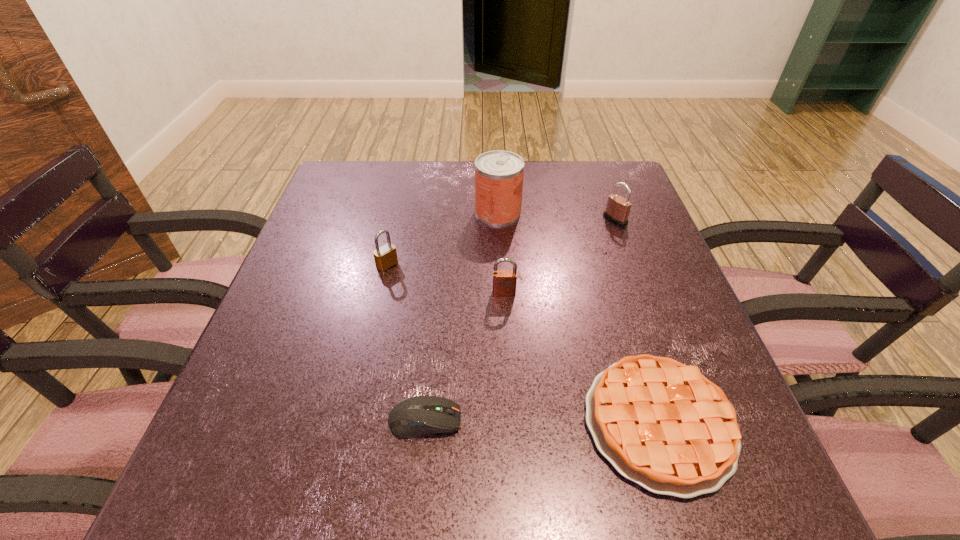
This screenshot has width=960, height=540. What are the coordinates of `free space located 0.080m on the back of the second farthest padlock` in the screenshot? It's located at (394, 236).

Where is `free space located 0.190m on the front-facing side of the third nearest object`? free space located 0.190m on the front-facing side of the third nearest object is located at coordinates (509, 374).

Identify the location of free space located on the left of the pie. (355, 423).

This screenshot has height=540, width=960. Identify the location of vacant area situated 0.260m on the button of the fifth object from right to left. (621, 420).

Identify the location of object that is positioned at the far edge. The height and width of the screenshot is (540, 960). (499, 174).

Locate an element on the screen. Image resolution: width=960 pixels, height=540 pixels. object present at the near edge is located at coordinates (663, 425).

You are a GUI agent. You are given a task and a screenshot of the screen. Output one action in this format:
    pyautogui.click(x=<x>, y=<y>)
    Task: Click on the padlock that is at the right edge
    The height and width of the screenshot is (540, 960).
    Given the screenshot: What is the action you would take?
    pyautogui.click(x=617, y=210)

Identify the location of pie that is at the right edge. This screenshot has width=960, height=540. (663, 425).

The height and width of the screenshot is (540, 960). What are the coordinates of `object that is at the near right corner` in the screenshot? It's located at (663, 425).

Where is `free point at the far edge`? The width and height of the screenshot is (960, 540). free point at the far edge is located at coordinates (419, 160).